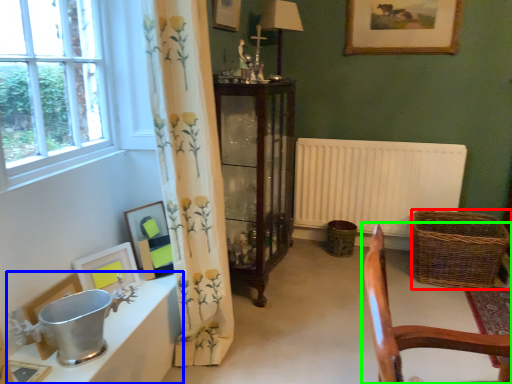
Question: Based on their relative distances, which object is nearer to basket (highlighted by a red box)? Choose from table (highlighted by a blue box) and chair (highlighted by a green box).

Choices:
 (A) table
 (B) chair

Answer: (B)